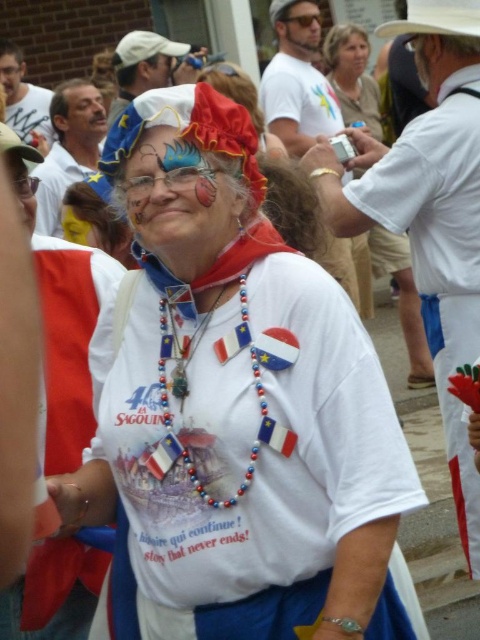
Question: Which object is farther from the camera taking this photo?

Choices:
 (A) multicolored beaded necklace at center
 (B) white fabric shirt at center
 (C) white matte shirt at center
 (D) matte plastic mask at center

Answer: (D)

Question: Among these objects, which one is farthest from the camera?

Choices:
 (A) matte plastic mask at center
 (B) multicolored beaded necklace at center
 (C) white fabric cowboy hat at upper center
 (D) white matte shirt at center

Answer: (A)

Question: From the image, what is the correct spatial relationship of white matte shirt at center in relation to multicolored beaded necklace at center?

Choices:
 (A) below
 (B) above

Answer: (B)

Question: Considering the real-world distances, which object is farthest from the matte plastic mask at center?

Choices:
 (A) multicolored beaded necklace at center
 (B) white fabric cowboy hat at upper center
 (C) white fabric shirt at center

Answer: (A)

Question: Is white matte shirt at center thinner than multicolored beaded necklace at center?

Choices:
 (A) no
 (B) yes

Answer: (A)

Question: Observing the image, what is the correct spatial positioning of white fabric shirt at center in reference to white matte shirt at center?

Choices:
 (A) above
 (B) below

Answer: (B)